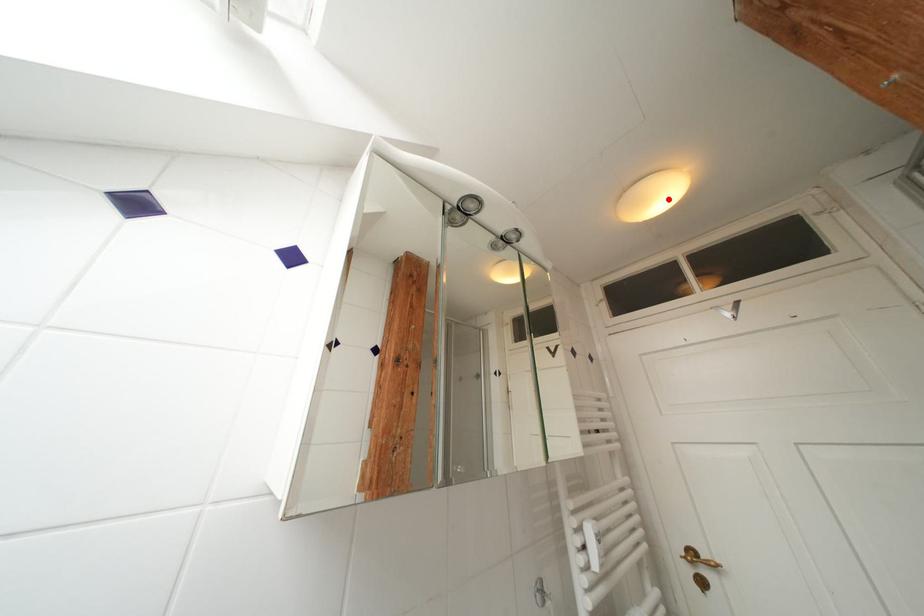
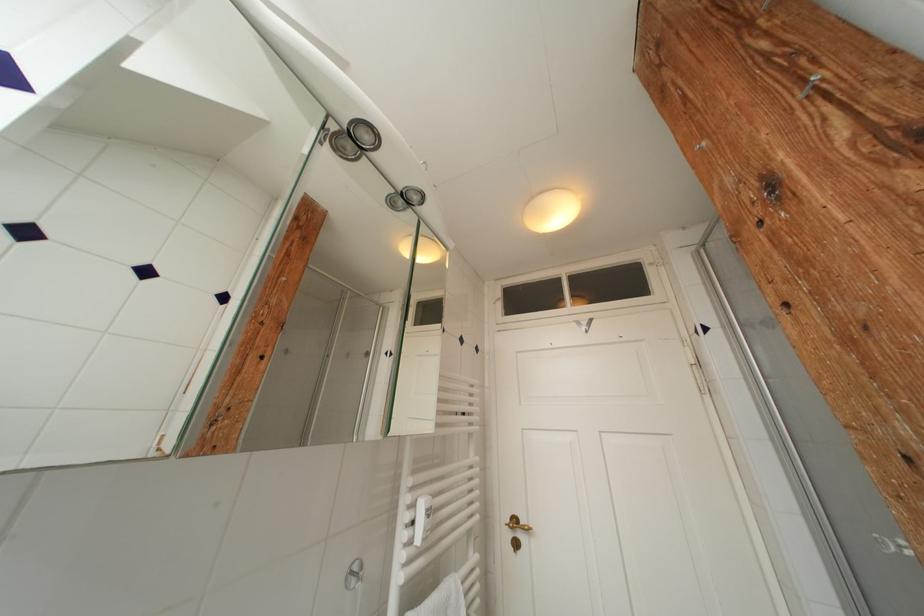
Question: I am providing you with two images of the same scene from different viewpoints. A red point is marked on the first image. At the location where the point appears in image 1, is it still visible in image 2?

Choices:
 (A) Yes
 (B) No

Answer: (A)